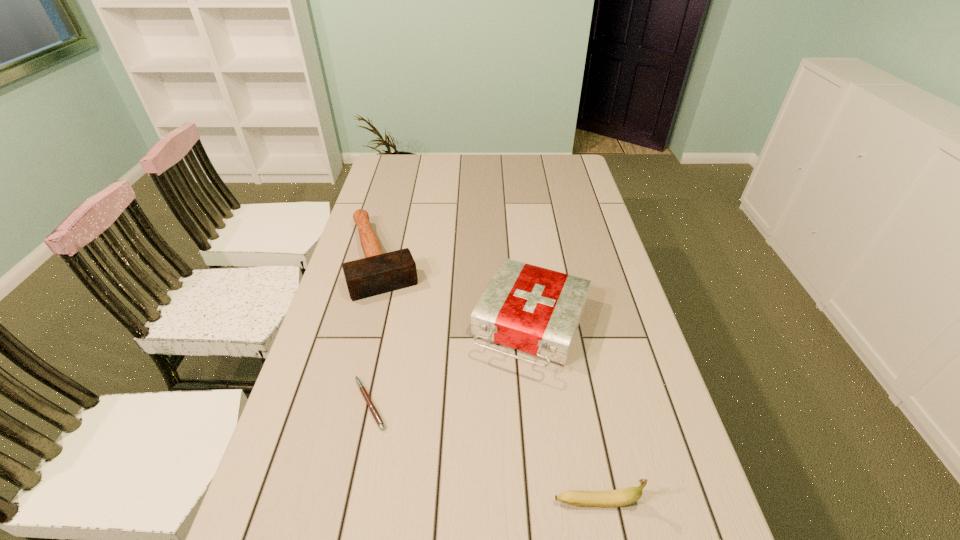
Locate an element on the screen. free space located on the front side of the first-aid kit is located at coordinates (444, 535).

Where is `vacant region located 0.360m on the front side of the first-aid kit`? vacant region located 0.360m on the front side of the first-aid kit is located at coordinates click(x=450, y=519).

This screenshot has width=960, height=540. I want to click on blank space located 0.300m on the front side of the first-aid kit, so click(463, 490).

You are a GUI agent. You are given a task and a screenshot of the screen. Output one action in this format:
    pyautogui.click(x=<x>, y=<y>)
    Task: Click on the object present at the near edge
    The image size is (960, 540).
    Given the screenshot: What is the action you would take?
    pyautogui.click(x=611, y=498)

Where is `pen positioned at the left edge`? Image resolution: width=960 pixels, height=540 pixels. pen positioned at the left edge is located at coordinates (372, 408).

You are a GUI agent. You are given a task and a screenshot of the screen. Output one action in this format:
    pyautogui.click(x=<x>, y=<y>)
    Task: Click on the mallet located in the left edge section of the desktop
    The width and height of the screenshot is (960, 540).
    Given the screenshot: What is the action you would take?
    pyautogui.click(x=377, y=273)

At what (x,y) coordinates should I click in order to perform the action: click on banana that is at the right edge. Please return your answer as a coordinate pair (x, y). Looking at the image, I should click on (611, 498).

In order to click on the first-aid kit that is positioned at the right edge in this screenshot , I will do `click(536, 310)`.

Find the location of `object that is at the near right corner`. object that is at the near right corner is located at coordinates (611, 498).

In the image, there is a desktop. Identify the location of vacant area at the far edge. (463, 174).